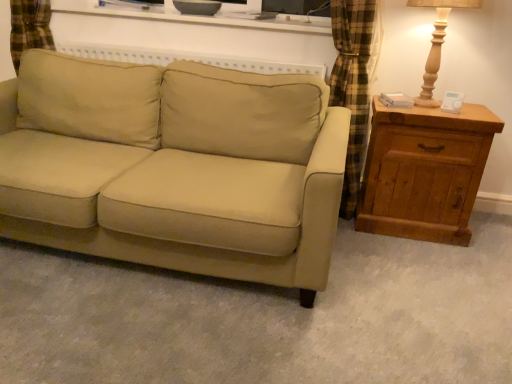
Question: From the image's perspective, is wooden table lamp at right above or below wooden chest of drawers at right?

Choices:
 (A) above
 (B) below

Answer: (A)

Question: Do you think wooden table lamp at right is within wooden chest of drawers at right, or outside of it?

Choices:
 (A) outside
 (B) inside

Answer: (A)

Question: Which of these objects is positioned closest to the matte white shelf at upper center?

Choices:
 (A) wooden chest of drawers at right
 (B) beige fabric couch at center
 (C) wooden table lamp at right

Answer: (C)

Question: Considering the real-world distances, which object is closest to the matte white shelf at upper center?

Choices:
 (A) wooden chest of drawers at right
 (B) wooden table lamp at right
 (C) beige fabric couch at center

Answer: (B)